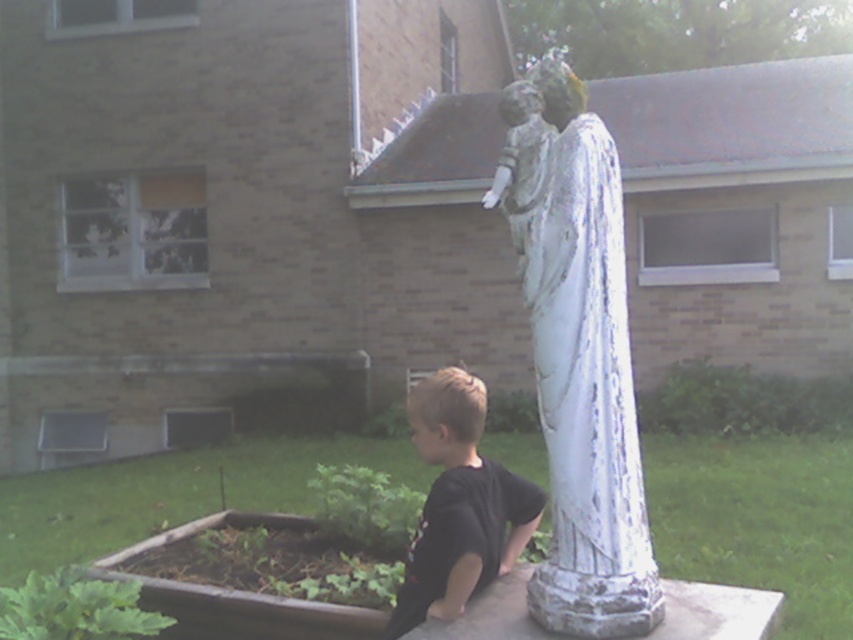
Can you confirm if white cracked statue at lower right is taller than black matte shirt at lower center?

No, white cracked statue at lower right is not taller than black matte shirt at lower center.

Does white cracked statue at lower right appear over black matte shirt at lower center?

No, white cracked statue at lower right is not above black matte shirt at lower center.

Who is more forward, (727, 442) or (404, 611)?

Point (404, 611)

This screenshot has height=640, width=853. I want to click on white cracked statue at lower right, so click(759, 520).

Which is below, white chipped paint statue at center or black matte shirt at lower center?

black matte shirt at lower center

Can you confirm if white chipped paint statue at center is positioned to the right of black matte shirt at lower center?

Indeed, white chipped paint statue at center is positioned on the right side of black matte shirt at lower center.

Does point (566, 390) come in front of point (437, 406)?

Yes.

Image resolution: width=853 pixels, height=640 pixels. Identify the location of white chipped paint statue at center. (579, 356).

What do you see at coordinates (579, 356) in the screenshot? The height and width of the screenshot is (640, 853). I see `white chipped paint statue at center` at bounding box center [579, 356].

Identify the location of white chipped paint statue at center. (579, 356).